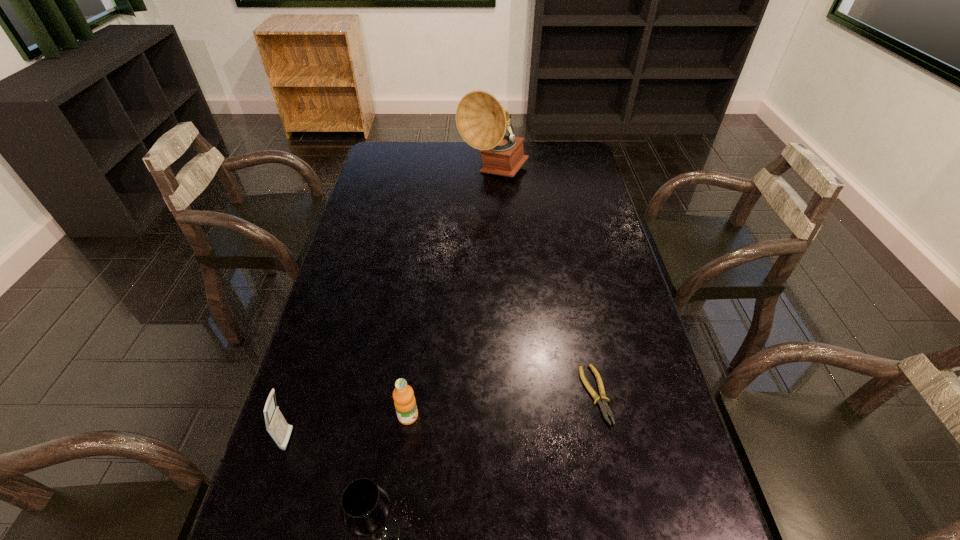
I want to click on vacant spot on the desktop that is between the wineglass and the shortest object and is positioned on the label of the fourth tallest object, so click(525, 440).

You are a GUI agent. You are given a task and a screenshot of the screen. Output one action in this format:
    pyautogui.click(x=<x>, y=<y>)
    Task: Click on the vacant space on the desktop that is between the nearest object and the shortest object and is positioned on the front-facing side of the cellular telephone
    This screenshot has height=540, width=960.
    Given the screenshot: What is the action you would take?
    pyautogui.click(x=519, y=444)

You are a GUI agent. You are given a task and a screenshot of the screen. Output one action in this format:
    pyautogui.click(x=<x>, y=<y>)
    Task: Click on the vacant space on the desktop that is between the wineglass and the shortest object and is positioned on the horn of the second object from right to left
    The width and height of the screenshot is (960, 540).
    Given the screenshot: What is the action you would take?
    pyautogui.click(x=509, y=450)